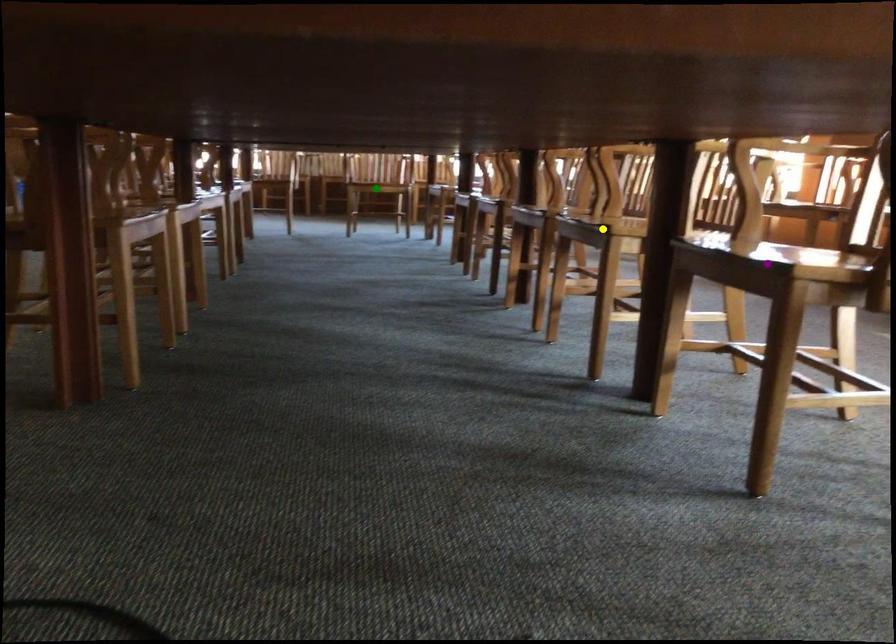
Order these from nearest to farthest:
yellow point | green point | purple point

1. green point
2. yellow point
3. purple point